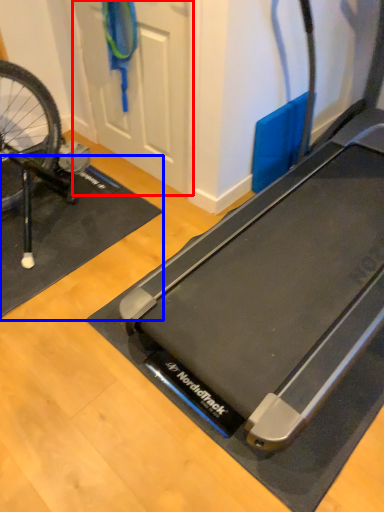
Question: Among these objects, which one is farthest to the camera, door (highlighted by a red box) or yoga mat (highlighted by a blue box)?

Choices:
 (A) door
 (B) yoga mat

Answer: (B)